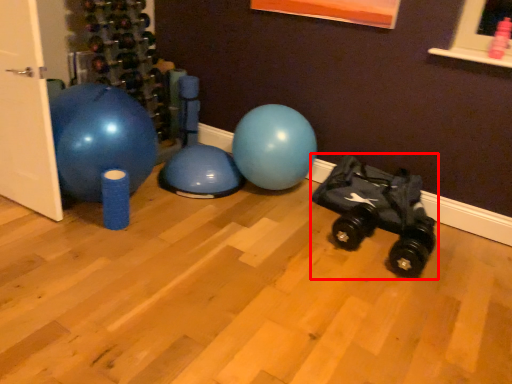
Question: From the image's perspective, where is baby carriage (annotated by the red box) located relative to door?

Choices:
 (A) above
 (B) below

Answer: (B)